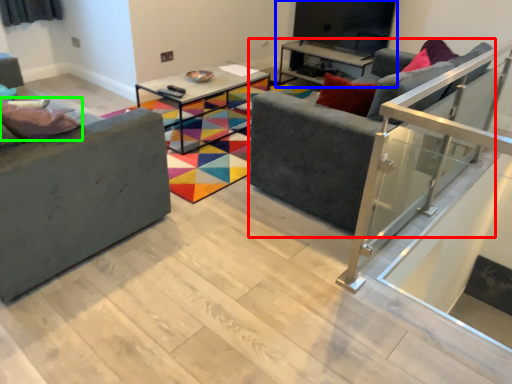
Question: Which is farther away from studio couch (highlighted by a red box)? entertainment center (highlighted by a blue box) or pillow (highlighted by a green box)?

Choices:
 (A) entertainment center
 (B) pillow

Answer: (A)